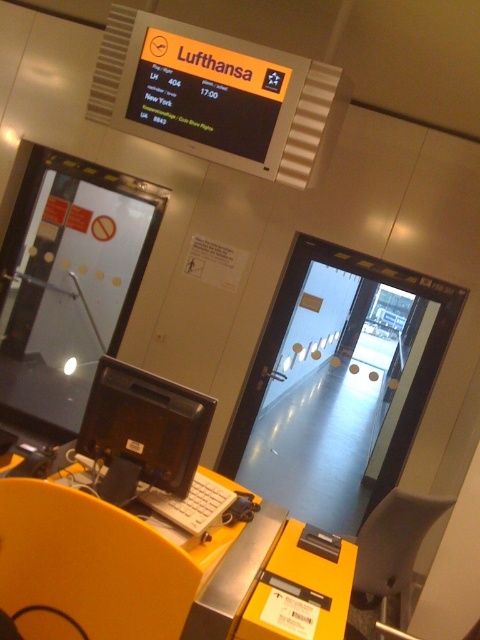
Does yellow plastic chair at lower left appear under white plastic keyboard at center?

Yes, yellow plastic chair at lower left is below white plastic keyboard at center.

Which is behind, point (142, 582) or point (203, 524)?

The point (203, 524) is behind.

Find the location of a particular element. This screenshot has width=480, height=640. yellow plastic chair at lower left is located at coordinates (86, 566).

Locate an element on the screen. black plastic chair at lower right is located at coordinates (392, 550).

What are the coordinates of `black plastic chair at lower right` in the screenshot? It's located at [392, 550].

Which is below, yellow plastic table at lower left or white plastic keyboard at center?

yellow plastic table at lower left is below.

Between point (232, 534) and point (173, 500), which one is positioned behind?

Positioned behind is point (232, 534).

I want to click on yellow plastic table at lower left, so click(154, 572).